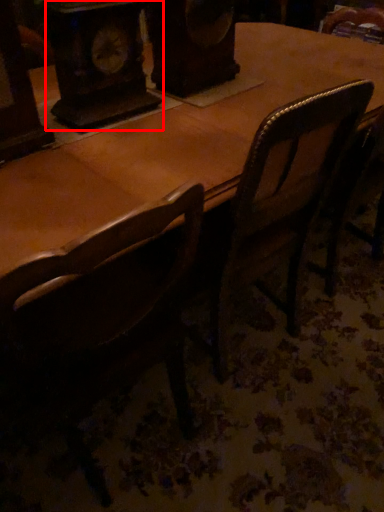
Question: Observing the image, what is the correct spatial positioning of clock (annotated by the red box) in reference to chair?

Choices:
 (A) right
 (B) left

Answer: (B)